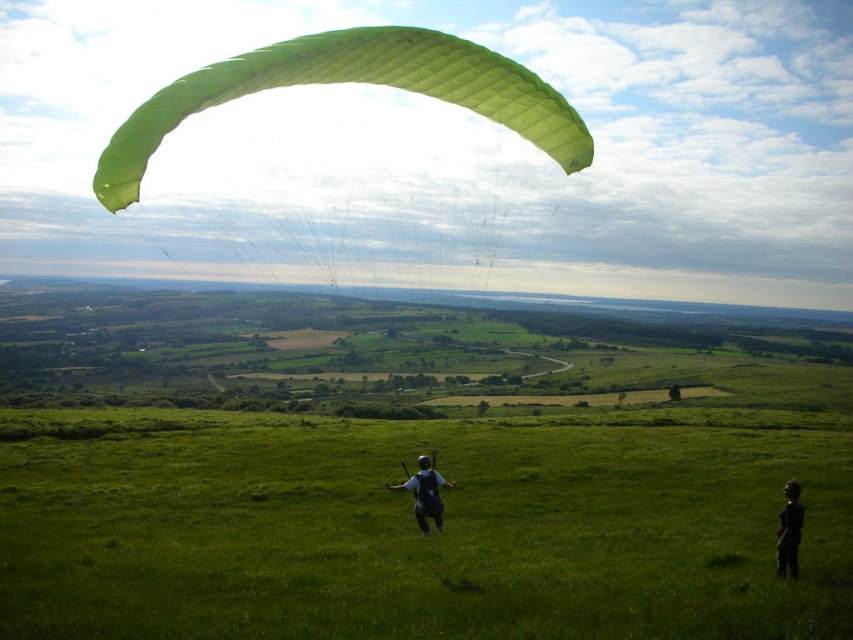
Can you confirm if green fabric parachute at upper center is shorter than black fabric parachute at center?

Incorrect, green fabric parachute at upper center's height does not fall short of black fabric parachute at center's.

Is green fabric parachute at upper center positioned before black fabric parachute at center?

Yes, green fabric parachute at upper center is in front of black fabric parachute at center.

Locate an element on the screen. The width and height of the screenshot is (853, 640). green fabric parachute at upper center is located at coordinates (352, 81).

Does black fabric parachute at center appear on the right side of dark fabric person at lower right?

No, black fabric parachute at center is not to the right of dark fabric person at lower right.

Between point (440, 483) and point (781, 540), which one is positioned in front?

Positioned in front is point (781, 540).

Does point (439, 515) come in front of point (787, 532)?

No, (439, 515) is behind (787, 532).

You are a GUI agent. You are given a task and a screenshot of the screen. Output one action in this format:
    pyautogui.click(x=<x>, y=<y>)
    Task: Click on the black fabric parachute at center
    The image size is (853, 640).
    Given the screenshot: What is the action you would take?
    pyautogui.click(x=425, y=493)

Describe the element at coordinates (352, 81) in the screenshot. Image resolution: width=853 pixels, height=640 pixels. I see `green fabric parachute at upper center` at that location.

Between point (424, 44) and point (798, 497), which one is positioned in front?

Point (424, 44)

Image resolution: width=853 pixels, height=640 pixels. Identify the location of green fabric parachute at upper center. (352, 81).